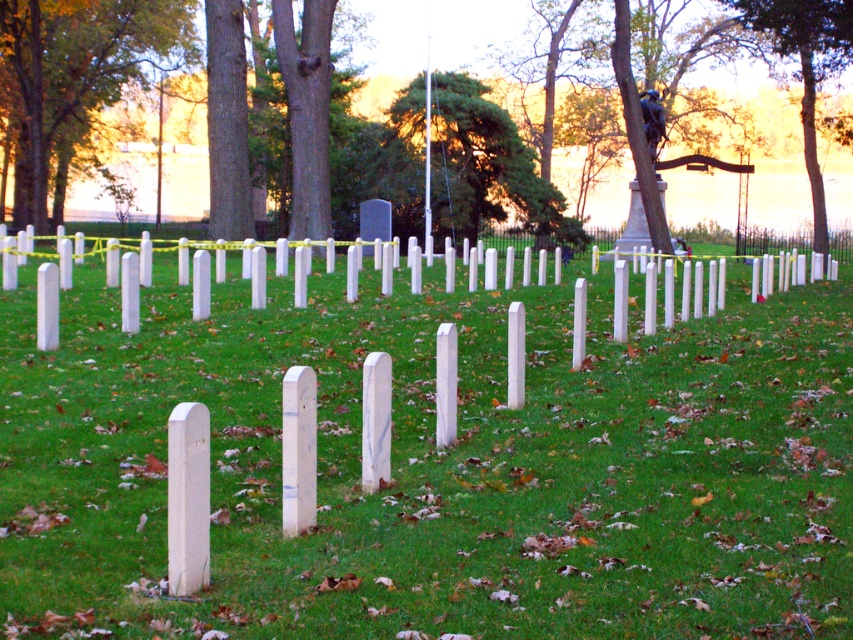
Does white smooth grass at center appear under green leafy tree at center?

Correct, white smooth grass at center is located below green leafy tree at center.

Does white smooth grass at center lie in front of green leafy tree at center?

Yes, it is.

Who is more distant from viewer, [317,616] or [503,145]?

Positioned behind is point [503,145].

You are a GUI agent. You are given a task and a screenshot of the screen. Output one action in this format:
    pyautogui.click(x=<x>, y=<y>)
    Task: Click on the white smooth grass at center
    This screenshot has width=853, height=640.
    Given the screenshot: What is the action you would take?
    pyautogui.click(x=434, y=464)

Which is below, white smooth grass at center or green leafy tree at upper center?

Positioned lower is white smooth grass at center.

Locate an element on the screen. The width and height of the screenshot is (853, 640). white smooth grass at center is located at coordinates (434, 464).

Does point (53, 205) come in front of point (415, 99)?

That is False.

Can you confirm if green leafy tree at upper left is thinner than green leafy tree at center?

Incorrect, green leafy tree at upper left's width is not less than green leafy tree at center's.

Find the location of a particular element. green leafy tree at upper left is located at coordinates (78, 76).